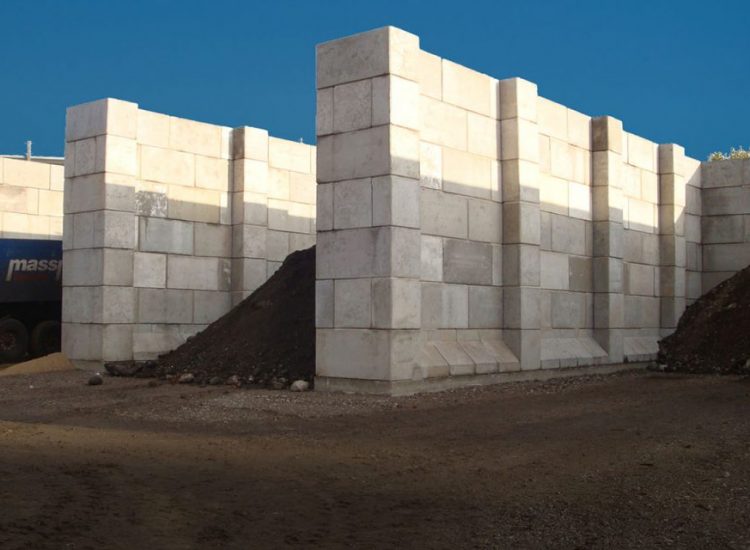
Find the location of `block wall right`. block wall right is located at coordinates (500, 309).